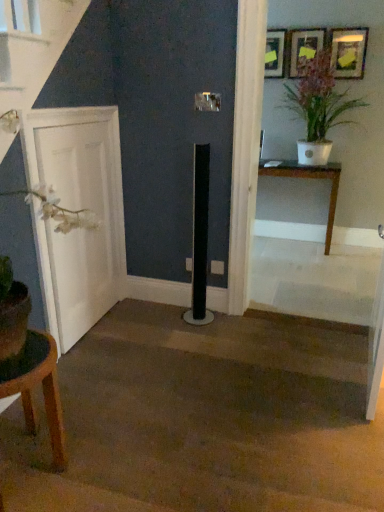
In order to click on free spot in front of white matte door at left in this screenshot , I will do pyautogui.click(x=103, y=367).